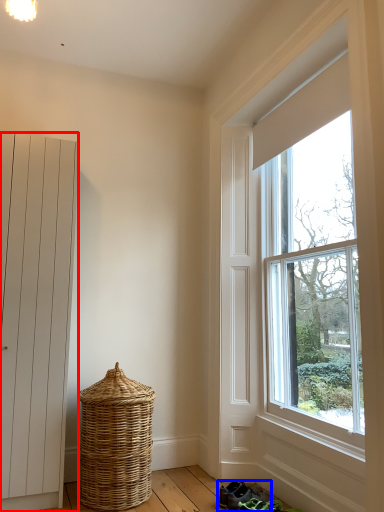
Question: Which of the following is the farthest to the observer, door (highlighted by a red box) or footwear (highlighted by a blue box)?

Choices:
 (A) door
 (B) footwear

Answer: (B)